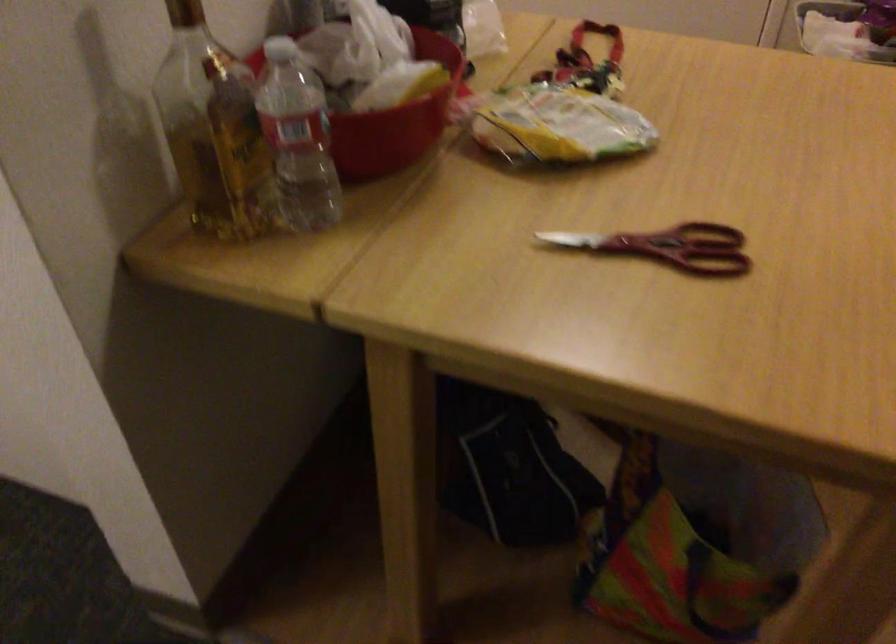
Find where to twist the white bottle cap. Please return your answer as a coordinate pair (x, y).

(280, 49)